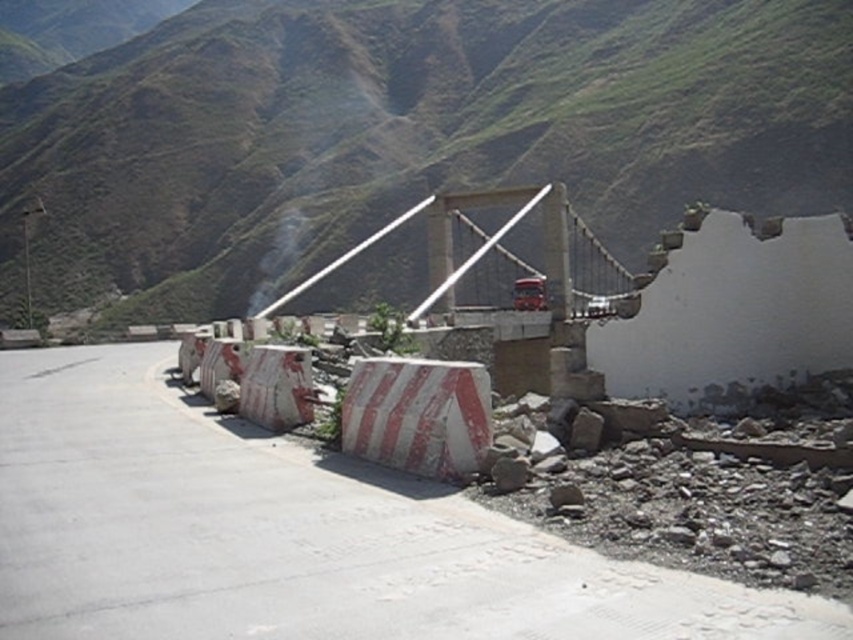
Question: Which object is farther from the camera taking this photo?

Choices:
 (A) white concrete barrier at center
 (B) gray rough rock at lower right

Answer: (B)

Question: Does green grassy mountain at upper center appear on the right side of gray rough rock at lower center?

Choices:
 (A) no
 (B) yes

Answer: (A)

Question: Can you confirm if white concrete barrier at center is positioned to the left of gray rough rock at lower right?

Choices:
 (A) yes
 (B) no

Answer: (A)

Question: Which object is positioned closest to the green grassy mountain at upper center?

Choices:
 (A) white concrete barrier at center
 (B) gray rough rock at lower center

Answer: (B)

Question: Can you confirm if green grassy mountain at upper center is thinner than gray rough rock at lower center?

Choices:
 (A) yes
 (B) no

Answer: (B)

Question: Among these objects, which one is farthest from the camera?

Choices:
 (A) white concrete barrier at center
 (B) green grassy mountain at upper center
 (C) gray rough rock at lower center

Answer: (B)